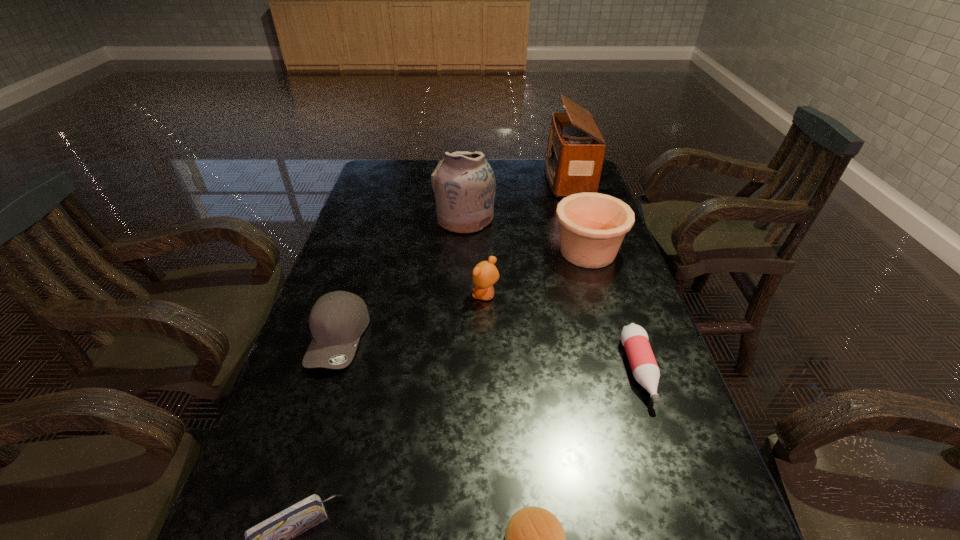
This screenshot has height=540, width=960. In order to click on vacant space located on the left of the shorter pottery in this screenshot , I will do `click(457, 252)`.

Where is `vacant area situated 0.130m on the face of the teddy bear`? vacant area situated 0.130m on the face of the teddy bear is located at coordinates (423, 295).

Find the location of `vacant space located 0.070m on the face of the teddy bear`. vacant space located 0.070m on the face of the teddy bear is located at coordinates (446, 295).

Where is `vacant area situated on the face of the teddy bear`? Image resolution: width=960 pixels, height=540 pixels. vacant area situated on the face of the teddy bear is located at coordinates click(449, 295).

Identify the location of vacant point located 0.330m on the front brim of the baseball cap. (275, 539).

This screenshot has width=960, height=540. What are the coordinates of `blank space located 0.240m with the cap open on the bottle` in the screenshot? It's located at (696, 539).

I want to click on object situated at the far edge, so click(575, 151).

Find the location of a particular element. The width and height of the screenshot is (960, 540). object that is at the left edge is located at coordinates (337, 320).

This screenshot has width=960, height=540. What are the coordinates of `radio receiver that is at the right edge` in the screenshot? It's located at (575, 151).

Locate an element on the screen. This screenshot has width=960, height=540. pottery that is at the right edge is located at coordinates (592, 225).